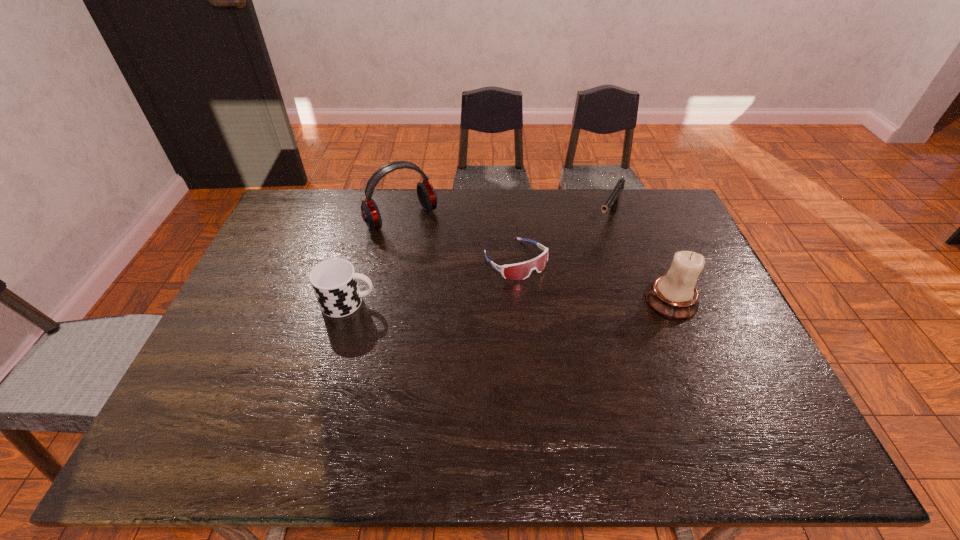
I want to click on vacant space located 0.140m on the ear cups of the earphone, so click(437, 259).

The image size is (960, 540). Identify the location of free region located 0.210m on the front-facing side of the shortest object. (577, 327).

At what (x,y) coordinates should I click in order to perform the action: click on free space located 0.220m on the front-facing side of the shortest object. Please return your answer as a coordinate pair (x, y). The width and height of the screenshot is (960, 540). Looking at the image, I should click on (580, 330).

You are a GUI agent. You are given a task and a screenshot of the screen. Output one action in this format:
    pyautogui.click(x=<x>, y=<y>)
    Task: Click on the vacant space located 0.250m on the front-facing side of the shortest object
    The width and height of the screenshot is (960, 540).
    Given the screenshot: What is the action you would take?
    pyautogui.click(x=587, y=338)

At what (x,y) coordinates should I click in order to perform the action: click on vacant area situated 0.300m at the muzzle of the pistol. Please return your answer as a coordinate pair (x, y). The width and height of the screenshot is (960, 540). Looking at the image, I should click on (569, 289).

In order to click on free space located 0.370m at the muzzle of the pistol in this screenshot , I will do 560,305.

The image size is (960, 540). Find the location of `free spot located at the muzzle of the pistol`. free spot located at the muzzle of the pistol is located at coordinates (592, 252).

Locate an element on the screen. This screenshot has height=540, width=960. earphone situated at the far edge is located at coordinates (426, 193).

You are a GUI agent. You are given a task and a screenshot of the screen. Output one action in this format:
    pyautogui.click(x=<x>, y=<y>)
    Task: Click on the pistol located in the far edge section of the desktop
    The image size is (960, 540).
    Given the screenshot: What is the action you would take?
    pyautogui.click(x=613, y=200)

Identify the location of object situated at the right edge. The image size is (960, 540). (674, 295).